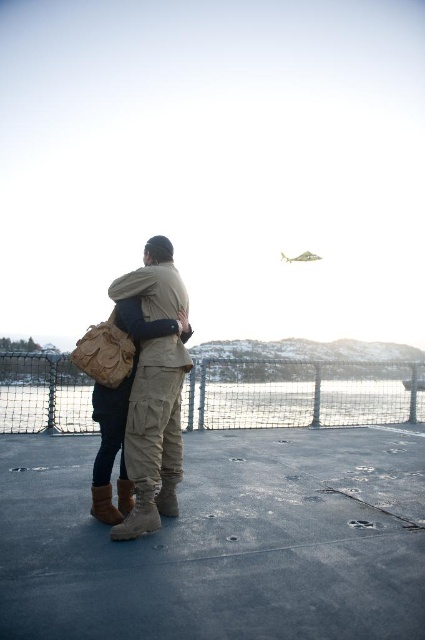
In the scene shown: What is the location of the point with coordinates (300, 394) in the image?

The point with coordinates (300, 394) is on the wire mesh fence at center.

You are a delivery drone trying to deliver a package to the ship deck. The wire mesh fence at center and camouflage cargo pants at center are in your path. Can you fly over both objects?

The wire mesh fence at center is not as tall as camouflage cargo pants at center. Since the camouflage cargo pants at center are taller, the drone cannot fly over them, so it cannot pass both objects.

You are a photographer trying to capture a closeup of the camouflage cargo pants at center without including the wire mesh fence at center in the frame. Is this possible given their positions?

The camouflage cargo pants at center is behind the wire mesh fence at center, so it is not possible to capture a closeup of the camouflage cargo pants at center without including the wire mesh fence at center in the frame.